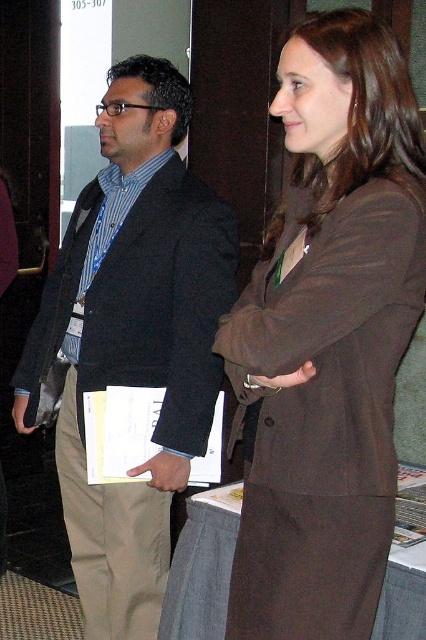
Based on the photo, which is below, brown matte suit at center or dark gray suit at left?

dark gray suit at left is lower down.

Can you confirm if brown matte suit at center is positioned to the left of dark gray suit at left?

Incorrect, brown matte suit at center is not on the left side of dark gray suit at left.

Which is behind, point (331, 365) or point (123, 83)?

Positioned behind is point (123, 83).

Where is `brown matte suit at center`? This screenshot has height=640, width=426. brown matte suit at center is located at coordinates (328, 336).

Is dark gray suit at left behind matte brown hand at center?

Yes, it is.

Who is higher up, dark gray suit at left or matte brown hand at center?

Positioned higher is dark gray suit at left.

Which is in front, point (135, 378) or point (279, 378)?

Point (279, 378)

You are a GUI agent. You are given a task and a screenshot of the screen. Output one action in this format:
    pyautogui.click(x=<x>, y=<y>)
    Task: Click on the dark gray suit at left
    The height and width of the screenshot is (640, 426).
    Given the screenshot: What is the action you would take?
    pyautogui.click(x=134, y=337)

Is brown matte suit at center smaller than matte brown hand at center?

Actually, brown matte suit at center might be larger than matte brown hand at center.

Which is above, brown matte suit at center or matte brown hand at center?

brown matte suit at center

Which is behind, point (226, 627) or point (284, 381)?

The point (226, 627) is behind.

Find the location of a particular element. This screenshot has width=426, height=640. brown matte suit at center is located at coordinates (328, 336).